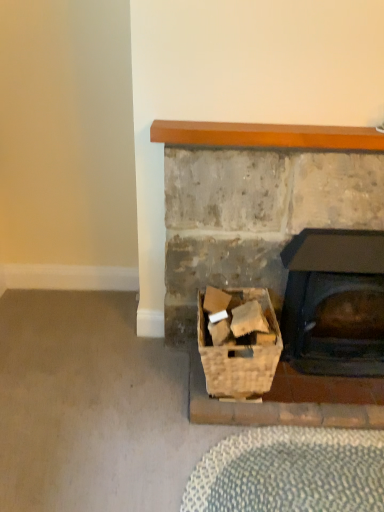
What is the approximate height of woven wood basket at lower center?

The height of woven wood basket at lower center is 14.97 inches.

Find the location of a particular element. This screenshot has height=512, width=384. woven wood basket at lower center is located at coordinates (239, 352).

From a real-world perspective, which object stands above the other?

rustic stone fireplace at lower right is physically above.

Is black matte wood burning stove at center right far away from rustic stone fireplace at lower right?

No, black matte wood burning stove at center right is not far from rustic stone fireplace at lower right.

Visually, is black matte wood burning stove at center right positioned to the left or to the right of rustic stone fireplace at lower right?

Based on their positions, black matte wood burning stove at center right is located to the right of rustic stone fireplace at lower right.

From the picture: Is rustic stone fireplace at lower right completely or partially inside black matte wood burning stove at center right?

No, rustic stone fireplace at lower right is not surrounded by black matte wood burning stove at center right.

From the image's perspective, between woven wood basket at lower center and rustic stone fireplace at lower right, which one is located above?

rustic stone fireplace at lower right, from the image's perspective.

In the scene shown: Is woven wood basket at lower center facing away from rustic stone fireplace at lower right?

That's right, woven wood basket at lower center is facing away from rustic stone fireplace at lower right.

Which object is wider, woven wood basket at lower center or rustic stone fireplace at lower right?

Wider between the two is woven wood basket at lower center.

Is woven wood basket at lower center in contact with rustic stone fireplace at lower right?

No, woven wood basket at lower center is not with rustic stone fireplace at lower right.

Measure the distance from wooden mantel at upper center to woven wood basket at lower center.

wooden mantel at upper center is 68.10 centimeters from woven wood basket at lower center.

Is wooden mantel at upper center looking in the opposite direction of woven wood basket at lower center?

No, wooden mantel at upper center is not facing the opposite direction of woven wood basket at lower center.

Is wooden mantel at upper center far from woven wood basket at lower center?

They are positioned close to each other.

From a real-world perspective, is black matte wood burning stove at center right located higher than wooden mantel at upper center?

No, from a real-world perspective, black matte wood burning stove at center right is not above wooden mantel at upper center.

From the image's perspective, is black matte wood burning stove at center right above or below wooden mantel at upper center?

Clearly, from the image's perspective, black matte wood burning stove at center right is below wooden mantel at upper center.

Is black matte wood burning stove at center right positioned far away from wooden mantel at upper center?

No, black matte wood burning stove at center right is not far away from wooden mantel at upper center.

Does point (336, 139) appear closer or farther from the camera than point (363, 245)?

Point (336, 139) is closer to the camera than point (363, 245).

Is wooden mantel at upper center facing towards black matte wood burning stove at center right?

No, wooden mantel at upper center is not aimed at black matte wood burning stove at center right.

You are a GUI agent. You are given a task and a screenshot of the screen. Output one action in this format:
    pyautogui.click(x=<x>, y=<y>)
    Task: Click on the balustrade on the left of black matte wood burning stove at center right
    This screenshot has width=384, height=512.
    Given the screenshot: What is the action you would take?
    pyautogui.click(x=266, y=135)

Which object is more forward, rustic stone fireplace at lower right or woven wood basket at lower center?

woven wood basket at lower center is closer to the camera.

This screenshot has width=384, height=512. Find the location of `fireplace that is behind the woven wood basket at lower center`. fireplace that is behind the woven wood basket at lower center is located at coordinates (276, 252).

Considering the positions of point (252, 270) and point (225, 393), is point (252, 270) closer or farther from the camera than point (225, 393)?

Point (252, 270) is positioned farther from the camera compared to point (225, 393).

Is wooden mantel at upper center bigger or smaller than rustic stone fireplace at lower right?

wooden mantel at upper center is smaller than rustic stone fireplace at lower right.

Considering the positions of objects wooden mantel at upper center and rustic stone fireplace at lower right in the image provided, who is behind, wooden mantel at upper center or rustic stone fireplace at lower right?

rustic stone fireplace at lower right is behind.

From a real-world perspective, between wooden mantel at upper center and rustic stone fireplace at lower right, who is vertically lower?

rustic stone fireplace at lower right is physically lower.

Considering the sizes of wooden mantel at upper center and rustic stone fireplace at lower right in the image, is wooden mantel at upper center taller or shorter than rustic stone fireplace at lower right?

Clearly, wooden mantel at upper center is shorter compared to rustic stone fireplace at lower right.

The height and width of the screenshot is (512, 384). I want to click on fireplace above the black matte wood burning stove at center right (from the image's perspective), so click(x=276, y=252).

Where is `fireplace that appears on the right of woven wood basket at lower center`? fireplace that appears on the right of woven wood basket at lower center is located at coordinates (276, 252).

Based on their spatial positions, is wooden mantel at upper center or woven wood basket at lower center closer to rustic stone fireplace at lower right?

Based on the image, woven wood basket at lower center appears to be nearer to rustic stone fireplace at lower right.

Estimate the real-world distances between objects in this image. Which object is closer to black matte wood burning stove at center right, rustic stone fireplace at lower right or wooden mantel at upper center?

Based on the image, rustic stone fireplace at lower right appears to be nearer to black matte wood burning stove at center right.

Based on their spatial positions, is rustic stone fireplace at lower right or black matte wood burning stove at center right further from woven wood basket at lower center?

black matte wood burning stove at center right is positioned further to the anchor woven wood basket at lower center.

From the image, which object appears to be farther from woven wood basket at lower center, wooden mantel at upper center or rustic stone fireplace at lower right?

wooden mantel at upper center is positioned further to the anchor woven wood basket at lower center.

Looking at the image, which one is located closer to wooden mantel at upper center, black matte wood burning stove at center right or rustic stone fireplace at lower right?

Among the two, rustic stone fireplace at lower right is located nearer to wooden mantel at upper center.

Which object lies further to the anchor point woven wood basket at lower center, black matte wood burning stove at center right or rustic stone fireplace at lower right?

black matte wood burning stove at center right is further to woven wood basket at lower center.

Considering their positions, is woven wood basket at lower center positioned further to wooden mantel at upper center than black matte wood burning stove at center right?

woven wood basket at lower center lies further to wooden mantel at upper center than the other object.

Which object lies nearer to the anchor point rustic stone fireplace at lower right, woven wood basket at lower center or wooden mantel at upper center?

woven wood basket at lower center.

The width and height of the screenshot is (384, 512). Identify the location of wood burning stove between wooden mantel at upper center and woven wood basket at lower center in the up-down direction. 334,302.

The image size is (384, 512). What are the coordinates of `fireplace located between woven wood basket at lower center and black matte wood burning stove at center right in the left-right direction` in the screenshot? It's located at (276, 252).

Where is `fireplace between wooden mantel at upper center and black matte wood burning stove at center right in the vertical direction`? Image resolution: width=384 pixels, height=512 pixels. fireplace between wooden mantel at upper center and black matte wood burning stove at center right in the vertical direction is located at coordinates (276, 252).

I want to click on fireplace between wooden mantel at upper center and woven wood basket at lower center vertically, so click(276, 252).